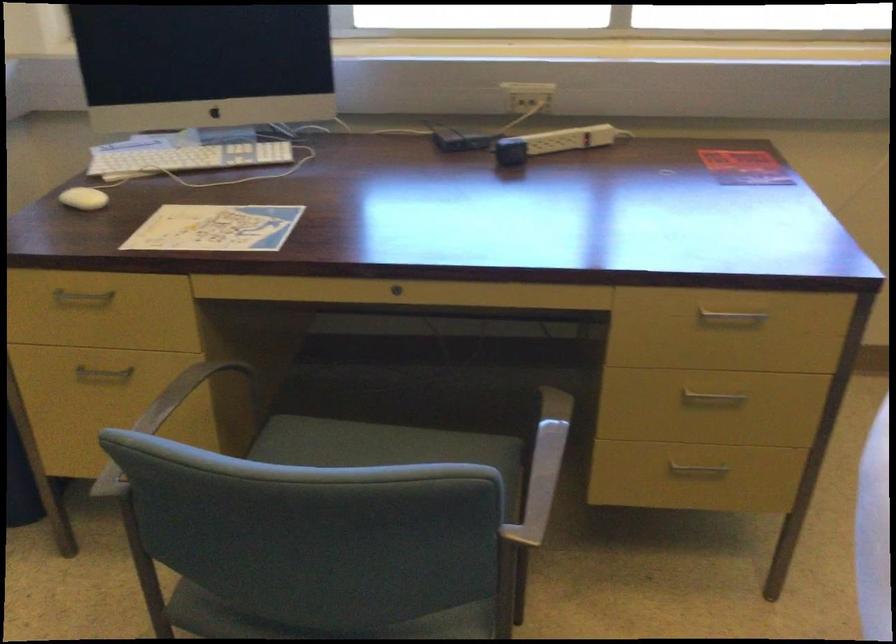
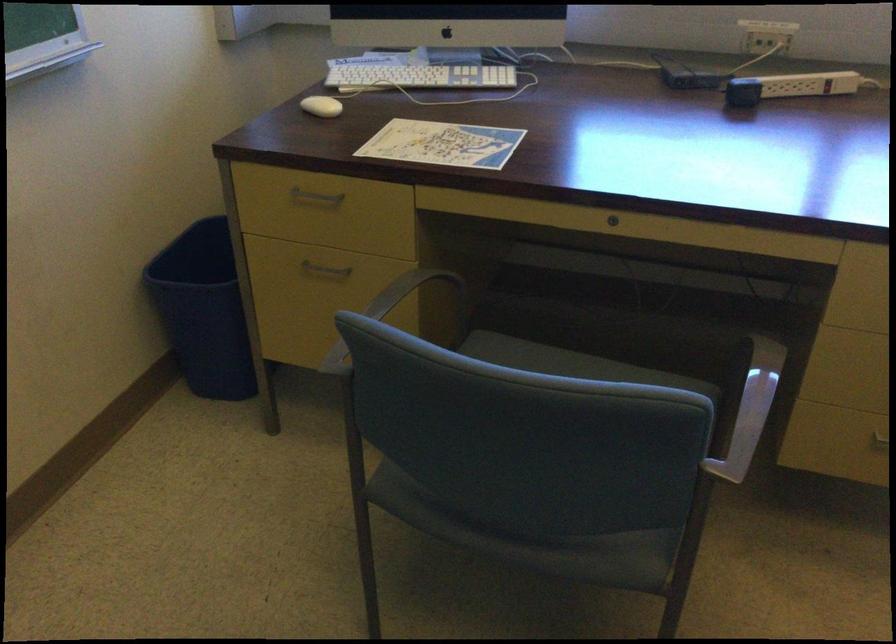
The point at [544,469] is marked in the first image. Where is the corresponding point in the second image?

(750, 410)